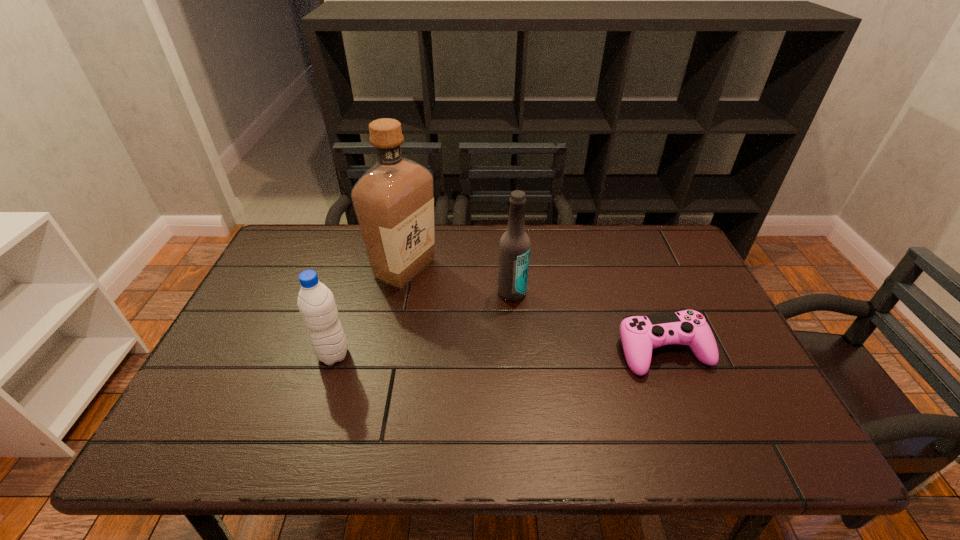
Locate an element on the screen. This screenshot has height=540, width=960. free space on the desktop that is between the water bottle and the rightmost object and is positioned on the front-facing side of the tallest object is located at coordinates (454, 354).

Locate an element on the screen. vacant space on the desktop that is between the third tallest object and the shortest object and is positioned on the label of the third object from left to right is located at coordinates (531, 353).